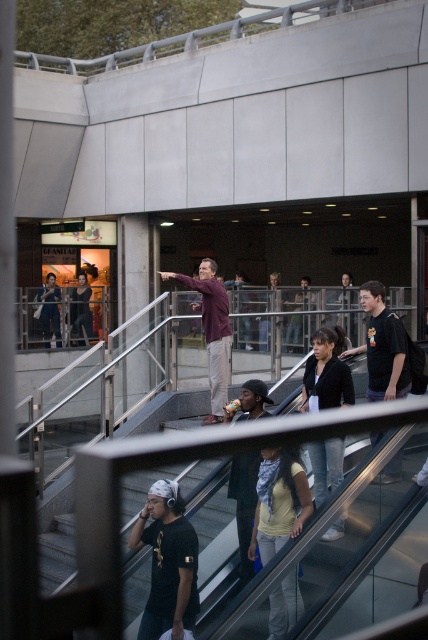
From the picture: Is black matte t-shirt at lower left in front of yellow matte shirt at lower center?

Yes.

Which is more to the left, black matte t-shirt at lower left or yellow matte shirt at lower center?

Positioned to the left is black matte t-shirt at lower left.

Measure the distance between black matte t-shirt at lower left and camera.

A distance of 3.26 meters exists between black matte t-shirt at lower left and camera.

Find the location of `black matte t-shirt at lower left`. black matte t-shirt at lower left is located at coordinates (168, 563).

Is denim jacket at lower right positioned in front of black matte shirt at right?

Yes, it is.

Describe the element at coordinates (326, 374) in the screenshot. I see `denim jacket at lower right` at that location.

In order to click on denim jacket at lower right in this screenshot , I will do `click(326, 374)`.

Between black matte t-shirt at lower left and maroon fabric skateboard at center, which one has more height?

Standing taller between the two is maroon fabric skateboard at center.

Is black matte t-shirt at lower left to the right of maroon fabric skateboard at center from the viewer's perspective?

No, black matte t-shirt at lower left is not to the right of maroon fabric skateboard at center.

The image size is (428, 640). In order to click on black matte t-shirt at lower left in this screenshot , I will do click(168, 563).